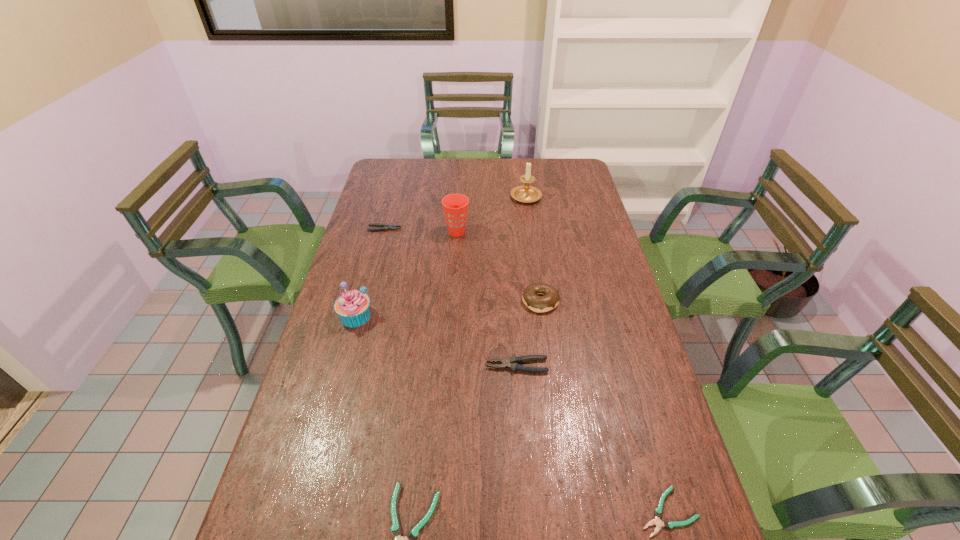
Where is `beige candle holder`? The width and height of the screenshot is (960, 540). beige candle holder is located at coordinates (526, 193).

This screenshot has width=960, height=540. Find the location of `the farthest object`. the farthest object is located at coordinates tap(526, 193).

Locate an element on the screen. The width and height of the screenshot is (960, 540). cup is located at coordinates (455, 206).

The image size is (960, 540). In order to click on the third tallest object in this screenshot , I will do `click(353, 307)`.

Where is `blue muffin`? The width and height of the screenshot is (960, 540). blue muffin is located at coordinates (353, 307).

This screenshot has height=540, width=960. What are the coordinates of `doughnut` in the screenshot? It's located at (550, 299).

Find the location of `the fourth tallest object`. the fourth tallest object is located at coordinates (550, 299).

In order to click on the right gray pliers in this screenshot , I will do click(x=503, y=363).

Image resolution: width=960 pixels, height=540 pixels. I want to click on the sixth farthest object, so pyautogui.click(x=503, y=363).

Locate an element on the screen. The image size is (960, 540). the leftmost pliers is located at coordinates (385, 227).